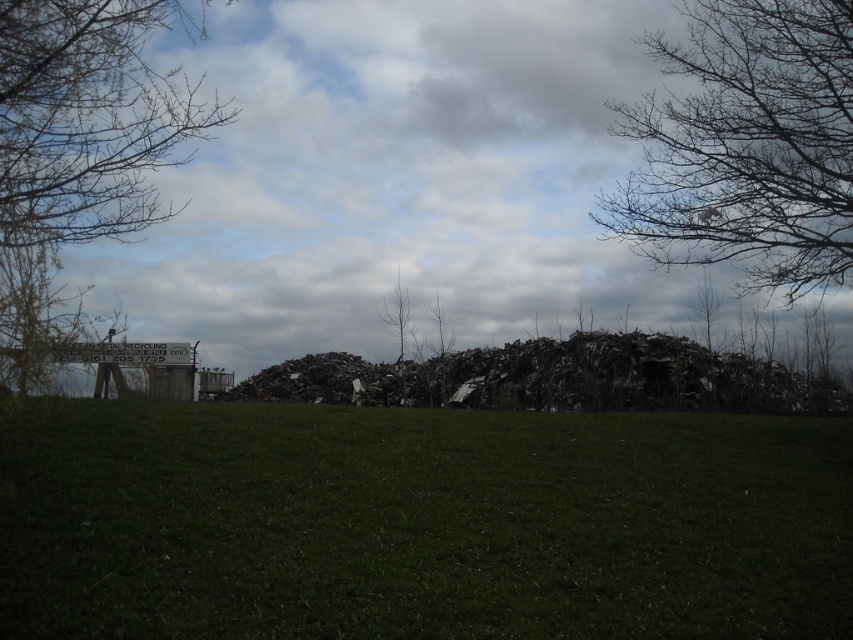
You are a GUI agent. You are given a task and a screenshot of the screen. Output one action in this format:
    pyautogui.click(x=<x>, y=<y>)
    Task: Click on the dark metallic debris at center
    This screenshot has width=853, height=640.
    Given the screenshot: What is the action you would take?
    pyautogui.click(x=564, y=378)

Does dark metallic debris at center have a smaller size compared to bare branch tree at center?

Incorrect, dark metallic debris at center is not smaller in size than bare branch tree at center.

Which is in front, point (550, 401) or point (407, 296)?

Positioned in front is point (550, 401).

Locate an element on the screen. Image resolution: width=853 pixels, height=640 pixels. dark metallic debris at center is located at coordinates (564, 378).

Who is taller, green grassy field at lower center or bare branches at upper right?

With more height is bare branches at upper right.

Which is in front, point (239, 554) or point (798, 156)?

Point (239, 554)

You are a GUI agent. You are given a task and a screenshot of the screen. Output one action in this format:
    pyautogui.click(x=<x>, y=<y>)
    Task: Click on the green grassy field at lower center
    This screenshot has height=640, width=853.
    Given the screenshot: What is the action you would take?
    pyautogui.click(x=421, y=524)

Can you confirm if green grassy field at lower center is taller than bare branches at upper left?

No.

Can you confirm if green grassy field at lower center is thinner than bare branches at upper left?

Incorrect, green grassy field at lower center's width is not less than bare branches at upper left's.

Between point (741, 532) and point (131, 193), which one is positioned in front?

Point (741, 532)

Locate an element on the screen. The width and height of the screenshot is (853, 640). green grassy field at lower center is located at coordinates (421, 524).